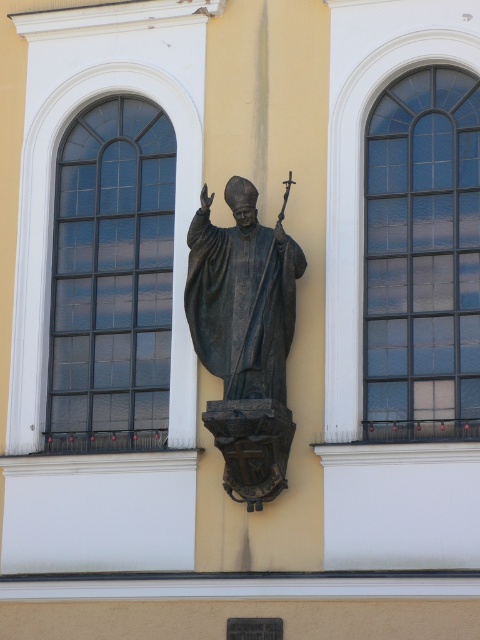
Does clear glass window at right appear over bronze statue at center?

Indeed, clear glass window at right is positioned over bronze statue at center.

Between clear glass window at right and bronze statue at center, which one has more height?

With more height is clear glass window at right.

Does point (437, 314) come in front of point (216, 260)?

Yes, it is in front of point (216, 260).

Identify the location of clear glass window at right. (422, 259).

Between point (400, 145) and point (90, 134), which one is positioned behind?

The point (90, 134) is more distant.

The height and width of the screenshot is (640, 480). In order to click on clear glass window at right in this screenshot , I will do (x=422, y=259).

What do you see at coordinates (422, 259) in the screenshot?
I see `clear glass window at right` at bounding box center [422, 259].

Identify the location of clear glass window at right. This screenshot has height=640, width=480. (422, 259).

Does black glass window at left appear on the left side of bronze statue at center?

Indeed, black glass window at left is positioned on the left side of bronze statue at center.

Between point (148, 288) and point (235, 435), which one is positioned behind?

The point (148, 288) is behind.

Is point (147, 426) less distant than point (286, 444)?

No, (147, 426) is behind (286, 444).

Where is `black glass window at left`? This screenshot has height=640, width=480. black glass window at left is located at coordinates (112, 280).